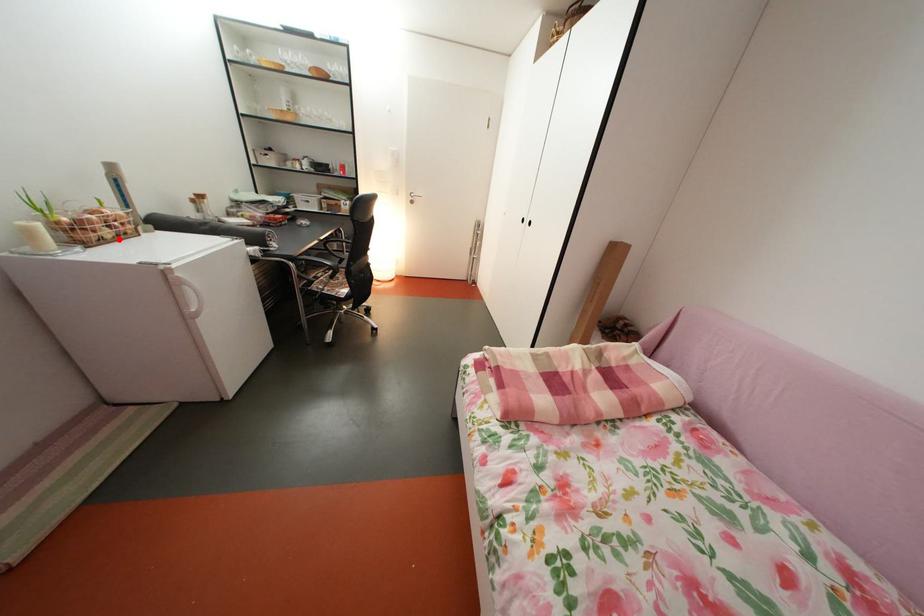
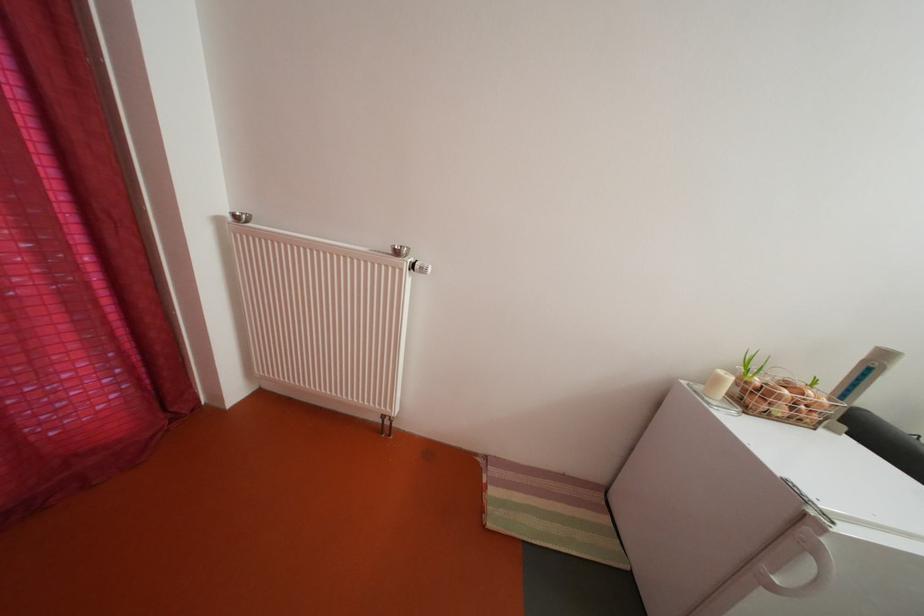
Find the pixel in the second image that matches the highlighted location in the first image.

(792, 416)